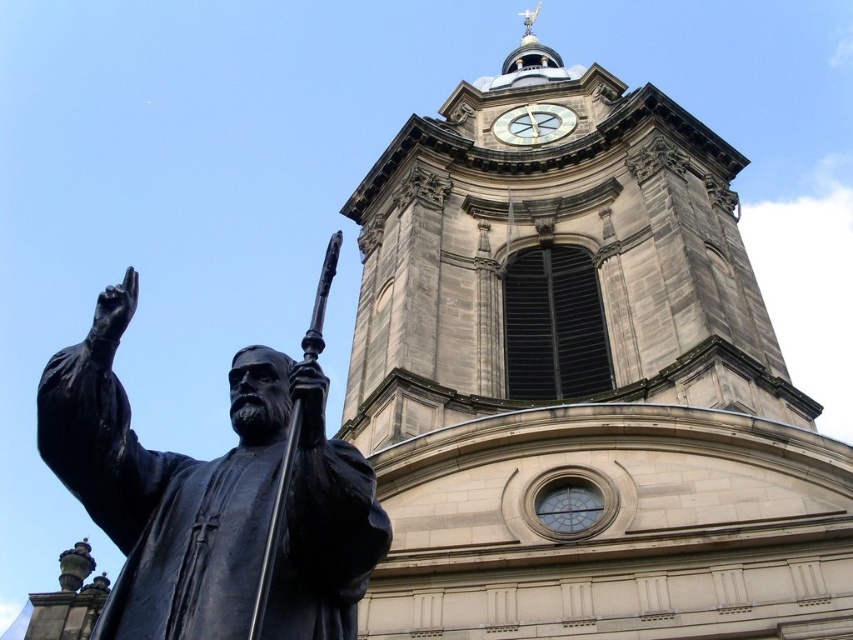
Who is lower down, black polished statue at left or white stone clock at upper center?

black polished statue at left is lower down.

Can you confirm if black polished statue at left is bigger than white stone clock at upper center?

Yes, black polished statue at left is bigger than white stone clock at upper center.

What do you see at coordinates (218, 493) in the screenshot? This screenshot has height=640, width=853. I see `black polished statue at left` at bounding box center [218, 493].

You are a GUI agent. You are given a task and a screenshot of the screen. Output one action in this format:
    pyautogui.click(x=<x>, y=<y>)
    Task: Click on the black polished statue at left
    
    Given the screenshot: What is the action you would take?
    pyautogui.click(x=218, y=493)